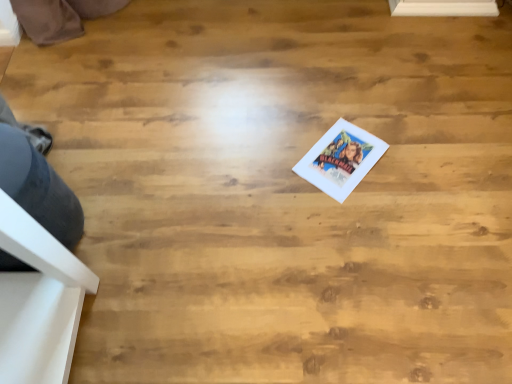
The width and height of the screenshot is (512, 384). I want to click on vacant space underneath matte paper postcard at center (from a real-world perspective), so [x=340, y=162].